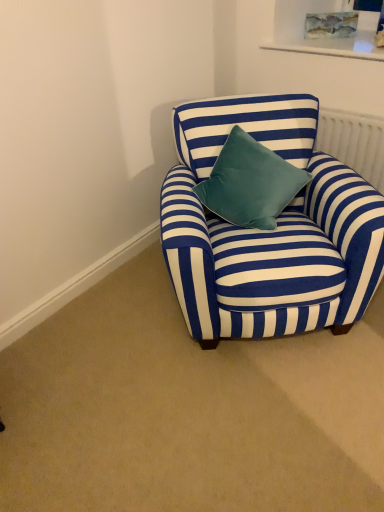
Question: Is white textured radiator at upper right outside of velvet teal pillow at center?

Choices:
 (A) yes
 (B) no

Answer: (A)

Question: Would you say white textured radiator at upper right is a long distance from velvet teal pillow at center?

Choices:
 (A) no
 (B) yes

Answer: (A)

Question: Is the depth of white textured radiator at upper right greater than that of velvet teal pillow at center?

Choices:
 (A) no
 (B) yes

Answer: (B)

Question: Is white textured radiator at upper right shorter than velvet teal pillow at center?

Choices:
 (A) no
 (B) yes

Answer: (B)

Question: Is white textured radiator at upper right taller than velvet teal pillow at center?

Choices:
 (A) yes
 (B) no

Answer: (B)

Question: Is white textured radiator at upper right at the right side of velvet teal pillow at center?

Choices:
 (A) yes
 (B) no

Answer: (A)

Question: Is blue striped fabric armchair at center surrounded by velvet teal pillow at center?

Choices:
 (A) no
 (B) yes

Answer: (A)

Question: Considering the relative sizes of velvet teal pillow at center and blue striped fabric armchair at center in the image provided, is velvet teal pillow at center wider than blue striped fabric armchair at center?

Choices:
 (A) yes
 (B) no

Answer: (B)

Question: Is velvet teal pillow at center beside blue striped fabric armchair at center?

Choices:
 (A) no
 (B) yes

Answer: (A)

Question: Could you tell me if velvet teal pillow at center is turned towards blue striped fabric armchair at center?

Choices:
 (A) yes
 (B) no

Answer: (A)

Question: From the image's perspective, is velvet teal pillow at center located beneath blue striped fabric armchair at center?

Choices:
 (A) yes
 (B) no

Answer: (B)

Question: Can you confirm if velvet teal pillow at center is positioned to the left of blue striped fabric armchair at center?

Choices:
 (A) yes
 (B) no

Answer: (A)

Question: Is blue striped fabric armchair at center completely or partially outside of velvet teal pillow at center?

Choices:
 (A) no
 (B) yes

Answer: (B)